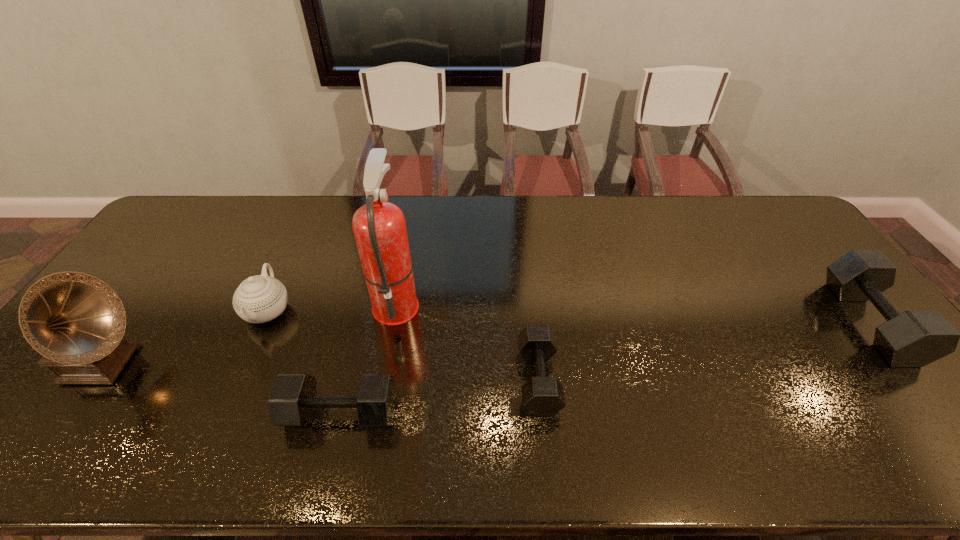
Find the location of a particular element. Image resolution: width=960 pixels, height=540 pixels. free location located 0.350m on the left of the leftmost dumbbell is located at coordinates (138, 413).

Locate an element on the screen. This screenshot has height=540, width=960. vacant area situated on the left of the shortest dumbbell is located at coordinates coord(443,379).

Image resolution: width=960 pixels, height=540 pixels. I want to click on vacant area situated 0.130m on the back of the rightmost object, so click(816, 254).

I want to click on vacant space located on the spout of the second object from left to right, so click(x=243, y=366).

Image resolution: width=960 pixels, height=540 pixels. In order to click on vacant region located with the handle and hose on the fire extinguisher in this screenshot , I will do `click(489, 303)`.

This screenshot has height=540, width=960. Identify the location of blank area located on the horn of the leftmost object. (193, 365).

This screenshot has width=960, height=540. What are the coordinates of `phonograph record located at the near edge` in the screenshot? It's located at (77, 322).

The width and height of the screenshot is (960, 540). In order to click on object that is at the left edge in this screenshot , I will do `click(77, 322)`.

Find the location of a particular element. object that is positioned at the right edge is located at coordinates (913, 338).

I want to click on object situated at the near left corner, so click(x=77, y=322).